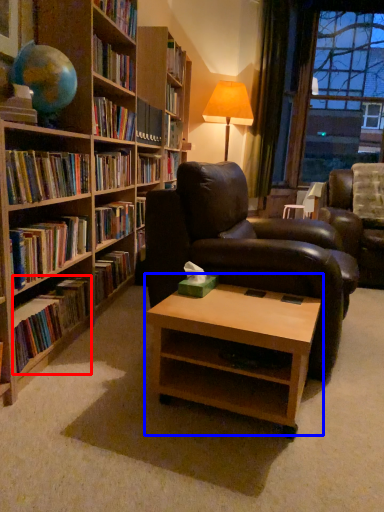
Question: Which object appears closest to the camera in this image, book (highlighted by a red box) or coffee table (highlighted by a blue box)?

Choices:
 (A) book
 (B) coffee table

Answer: (B)